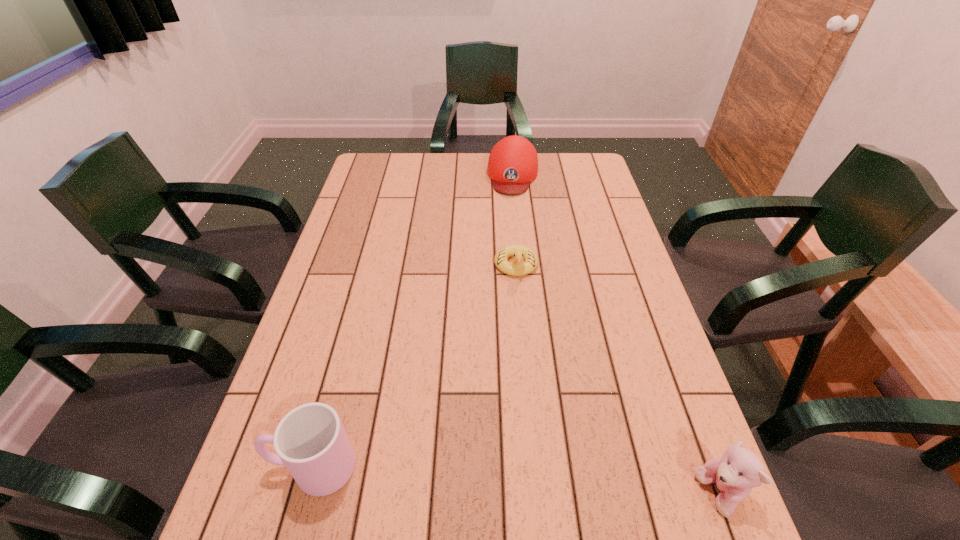
Locate an element on the screen. The width and height of the screenshot is (960, 540). object at the near right corner is located at coordinates (739, 470).

In the image, there is a desktop. At what (x,y) coordinates should I click in order to perform the action: click on blank space at the far edge. Please return your answer as a coordinate pair (x, y). The width and height of the screenshot is (960, 540). Looking at the image, I should click on [551, 183].

Locate an element on the screen. This screenshot has height=540, width=960. vacant space at the near edge of the desktop is located at coordinates (353, 474).

At what (x,y) coordinates should I click in order to perform the action: click on vacant area at the left edge of the desktop. Please return your answer as a coordinate pair (x, y). This screenshot has width=960, height=540. Looking at the image, I should click on (372, 267).

In the image, there is a desktop. Where is `free space at the right edge`? Image resolution: width=960 pixels, height=540 pixels. free space at the right edge is located at coordinates (639, 438).

The width and height of the screenshot is (960, 540). I want to click on vacant area that lies between the teddy bear and the leftmost object, so click(x=516, y=481).

Where is `blank region between the farthest object and the shortest object`? blank region between the farthest object and the shortest object is located at coordinates (515, 220).

Where is `vacant point located between the rightmost object and the cup`? The width and height of the screenshot is (960, 540). vacant point located between the rightmost object and the cup is located at coordinates (516, 481).

Identify the location of empty space between the third nearest object and the baseball cap. The width and height of the screenshot is (960, 540). pos(515,220).

The image size is (960, 540). In order to click on empty space between the third nearest object and the rightmost object in this screenshot , I will do `click(617, 380)`.